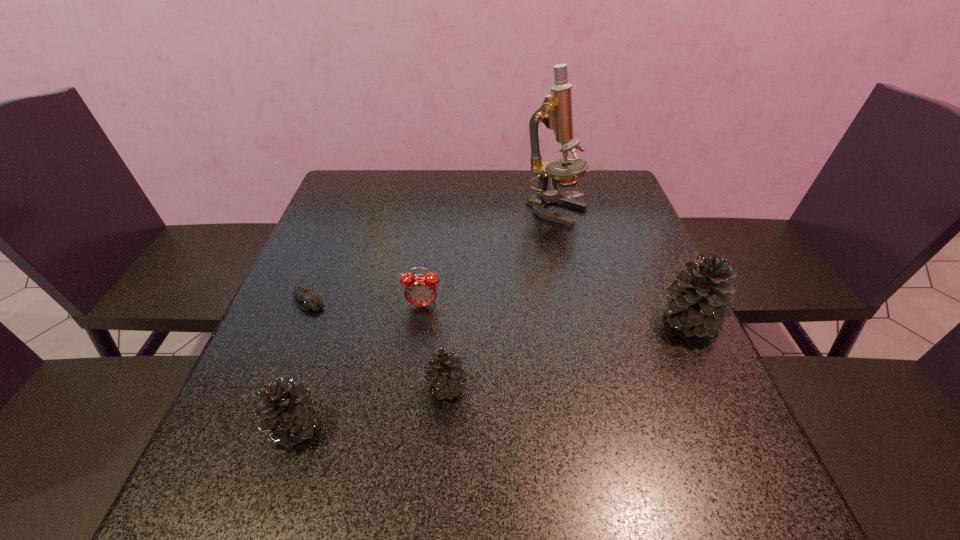
Find the location of a particular element. This screenshot has height=540, width=960. the second tallest pinecone is located at coordinates (291, 412).

Identify the location of the second pinecone from right to left. (445, 372).

Locate an element on the screen. The width and height of the screenshot is (960, 540). the rightmost object is located at coordinates (697, 302).

The height and width of the screenshot is (540, 960). Identify the location of the tallest pinecone. (697, 302).

Find the location of a particular element. This screenshot has width=960, height=540. microscope is located at coordinates (556, 113).

Find the location of a particular element. The height and width of the screenshot is (540, 960). the fifth object from left to right is located at coordinates (x=556, y=113).

The image size is (960, 540). Find the location of `the shortest object`. the shortest object is located at coordinates (307, 298).

At what (x,y) coordinates should I click in order to perform the action: click on alarm clock. Please return your answer as a coordinate pair (x, y). The height and width of the screenshot is (540, 960). Looking at the image, I should click on (420, 290).

Where is `vacant space located 0.240m on the right of the leftmost pinecone`? This screenshot has height=540, width=960. vacant space located 0.240m on the right of the leftmost pinecone is located at coordinates (463, 428).

In order to click on vacant space located on the left of the second pinecone from left to right in this screenshot , I will do `click(368, 387)`.